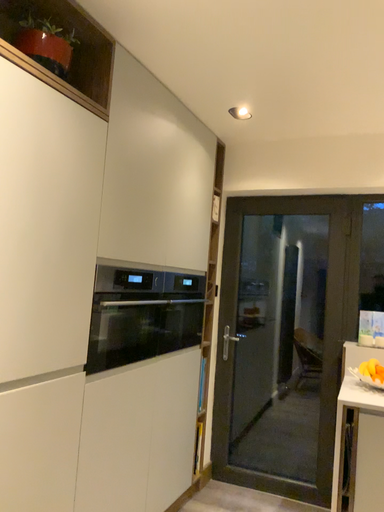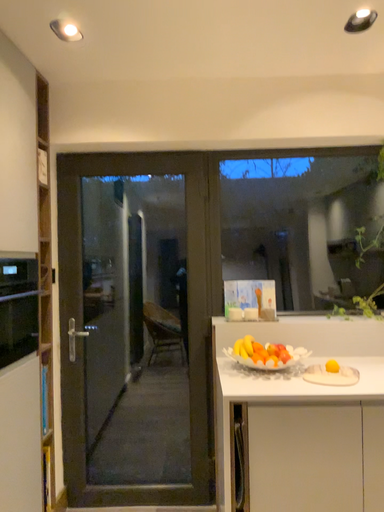
Question: Which way did the camera rotate in the video?

Choices:
 (A) rotated left
 (B) rotated right

Answer: (B)